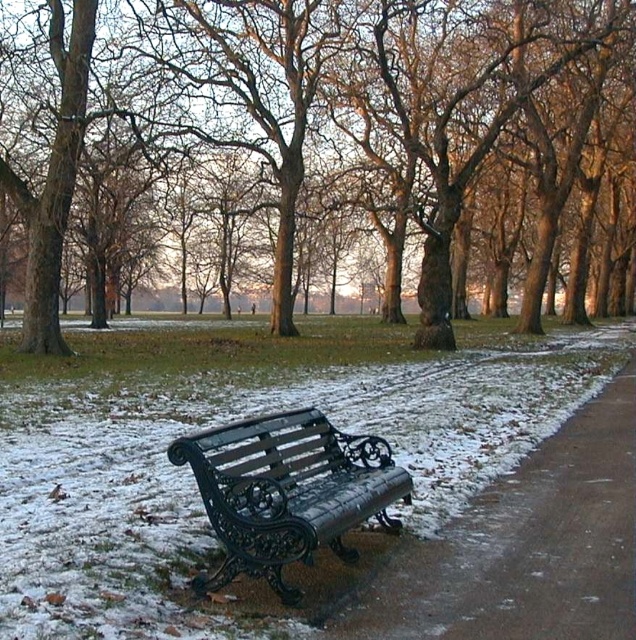
Between point (499, 541) and point (212, 449), which one is positioned behind?

The point (499, 541) is behind.

This screenshot has width=636, height=640. Describe the element at coordinates (522, 547) in the screenshot. I see `metal bench at center` at that location.

At what (x,y) coordinates should I click in order to perform the action: click on metal bench at center. Please return your answer as a coordinate pair (x, y). This screenshot has width=636, height=640. Looking at the image, I should click on [522, 547].

Does point (212, 248) come farther from viewer compared to point (481, 608)?

Yes, it is behind point (481, 608).

Measure the distance between smooth brown tree trunk at center and camera.

The distance of smooth brown tree trunk at center from camera is 19.55 meters.

In order to click on smooth brown tree trunk at center in this screenshot , I will do 331,147.

Between smooth brown tree trunk at center and black wrought iron bench at center, which one is positioned higher?

smooth brown tree trunk at center is higher up.

Which is in front, point (256, 260) or point (237, 513)?

Point (237, 513) is more forward.

The height and width of the screenshot is (640, 636). What are the coordinates of `smooth brown tree trunk at center` in the screenshot? It's located at tap(331, 147).